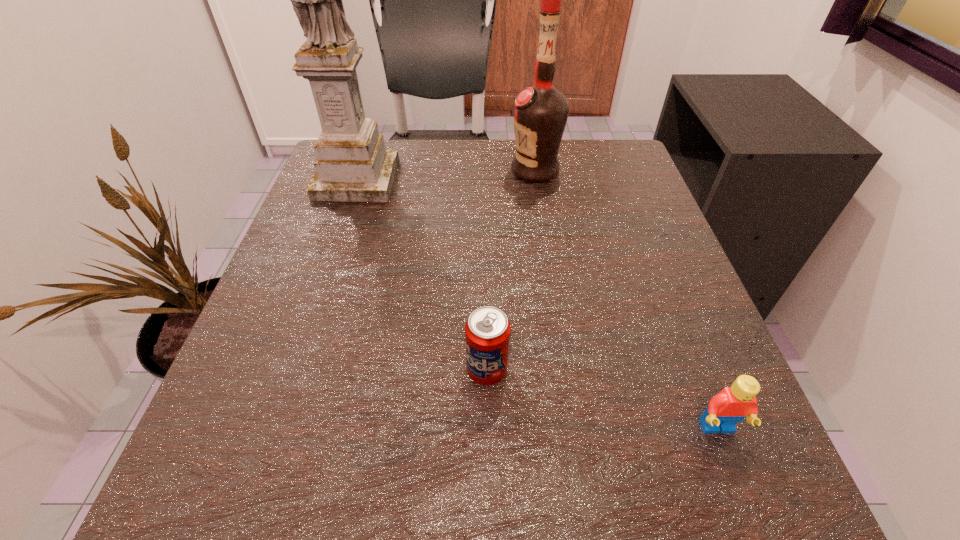
Find the location of a particular element. This screenshot has height=540, width=960. vacant area that lies between the tallest object and the second tallest object is located at coordinates (445, 175).

Locate an element on the screen. This screenshot has width=960, height=540. blank region between the soda can and the second tallest object is located at coordinates (511, 270).

I want to click on free point between the sculpture and the second object from left to right, so click(x=422, y=275).

Select which object appears as the second closest to the nearest object. Please provide its 2D coordinates. Your answer should be formatted as a tuple, i.e. [(x, y)], where the tuple contains the x and y coordinates of a point satisfying the conditions above.

[(540, 112)]

Choose which object is the second nearest neighbor to the tallest object. Please provide its 2D coordinates. Your answer should be formatted as a tuple, i.e. [(x, y)], where the tuple contains the x and y coordinates of a point satisfying the conditions above.

[(487, 330)]

Find the location of a particular element. Image resolution: width=960 pixels, height=540 pixels. vacant space that satisfies the following two spatial constraints: 1. on the front and back of the liquor; 2. on the front-facing side of the tallest object is located at coordinates (537, 179).

This screenshot has width=960, height=540. What are the coordinates of `free space that satisfies the following two spatial constraints: 1. on the front-facing side of the soda can; 2. on the left side of the leftmost object` in the screenshot? It's located at (292, 370).

Where is `vacant space that satisfies the following two spatial constraints: 1. on the front-facing side of the sculpture; 2. on the left side of the third object from right to left`? This screenshot has width=960, height=540. vacant space that satisfies the following two spatial constraints: 1. on the front-facing side of the sculpture; 2. on the left side of the third object from right to left is located at coordinates (292, 370).

You are a GUI agent. You are given a task and a screenshot of the screen. Output one action in this format:
    pyautogui.click(x=<x>, y=<y>)
    Task: Click on the vacant space that satisfies the following two spatial constraints: 1. on the front-facing side of the sculpture; 2. on the left side of the second object from left to right
    
    Given the screenshot: What is the action you would take?
    pyautogui.click(x=292, y=370)

At what (x,y) coordinates should I click in order to perform the action: click on free space that satisfies the following two spatial constraints: 1. on the front-facing side of the sculpture; 2. on the right side of the third farthest object. Please return your answer as a coordinate pair (x, y). The image size is (960, 540). Looking at the image, I should click on (292, 370).